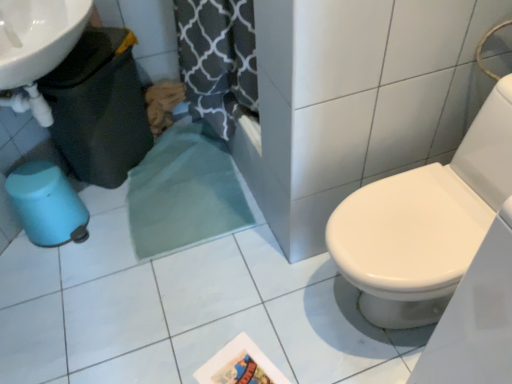
Image resolution: width=512 pixels, height=384 pixels. I want to click on free spot in front of matte black trash can at left, marked as the 1th potty in a top-to-bottom arrangement, so click(x=134, y=207).